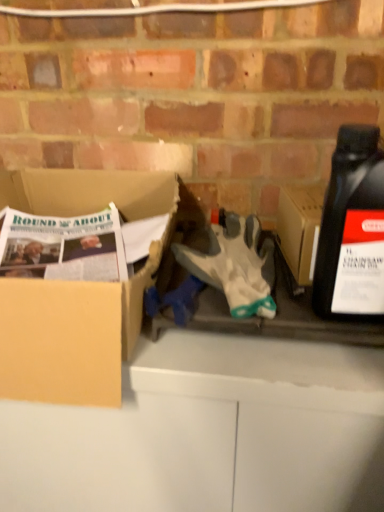
Question: Considering the positions of white fabric glove at center and cardboard box at left in the image, is white fabric glove at center taller or shorter than cardboard box at left?

Choices:
 (A) tall
 (B) short

Answer: (B)

Question: Is white fabric glove at center in front of or behind cardboard box at left in the image?

Choices:
 (A) behind
 (B) front

Answer: (A)

Question: Based on their relative distances, which object is farther from the black plastic bottle at right?

Choices:
 (A) white fabric glove at center
 (B) cardboard box at left

Answer: (B)

Question: Based on their relative distances, which object is farther from the white fabric glove at center?

Choices:
 (A) black plastic bottle at right
 (B) cardboard box at left

Answer: (B)